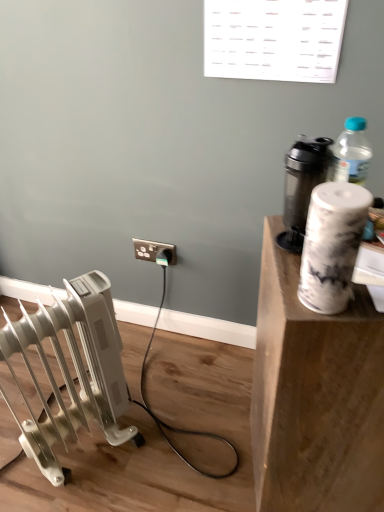
Question: Does point (357, 187) appear closer or farther from the camera than point (279, 499)?

Choices:
 (A) farther
 (B) closer

Answer: (B)

Question: From the image's perspective, is white marble paper towel at upper right located above or below white marble cup at upper right?

Choices:
 (A) above
 (B) below

Answer: (A)

Question: Which of these objects is positioned closest to the metallic gray shaker at upper right?

Choices:
 (A) black plastic electric outlet at center
 (B) white marble cup at upper right
 (C) white plastic radiator at lower left
 (D) white marble paper towel at upper right

Answer: (D)

Question: Based on their relative distances, which object is farther from the white marble cup at upper right?

Choices:
 (A) metallic gray shaker at upper right
 (B) white marble paper towel at upper right
 (C) white plastic radiator at lower left
 (D) black plastic electric outlet at center

Answer: (D)